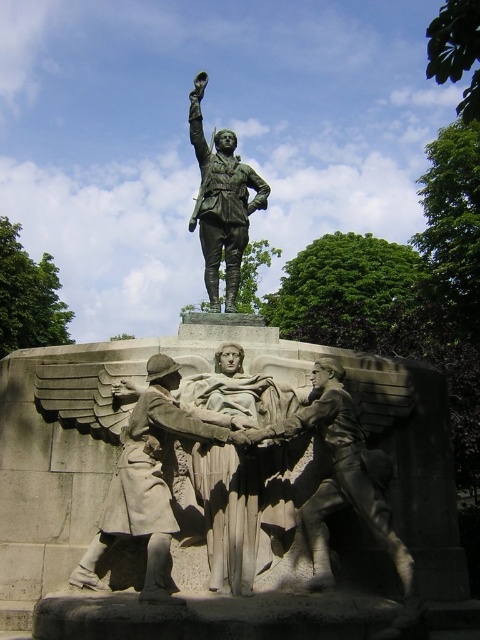
Question: Where is bronze statue of soldier at center located in relation to bronze statue at upper center in the image?

Choices:
 (A) above
 (B) below

Answer: (B)

Question: Which point appears farthest from the camera in this image?

Choices:
 (A) (309, 547)
 (B) (248, 228)

Answer: (B)

Question: Which object appears farthest from the camera in this image?

Choices:
 (A) bronze statue of soldier at center
 (B) bronze statue at upper center

Answer: (B)

Question: Which of the following is the closest to the observer?

Choices:
 (A) bronze statue at upper center
 (B) bronze statue of soldier at center

Answer: (B)

Question: Is bronze statue of soldier at center further to camera compared to bronze statue at upper center?

Choices:
 (A) yes
 (B) no

Answer: (B)

Question: Does bronze statue of soldier at center appear on the left side of bronze statue at upper center?

Choices:
 (A) yes
 (B) no

Answer: (B)